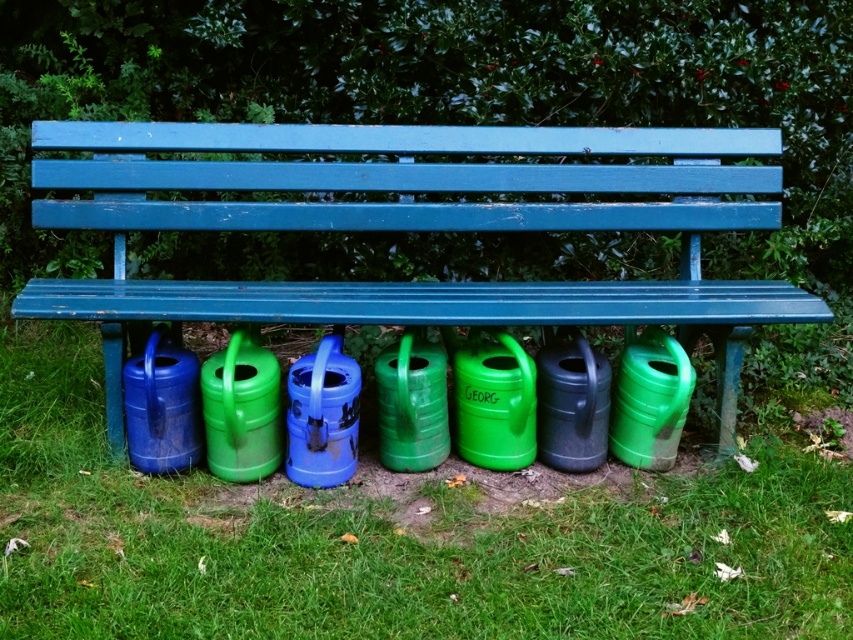
Does green matte watering cans at lower center have a smaller size compared to matte blue bench at center?

No.

Which is behind, point (850, 564) or point (372, 221)?

Positioned behind is point (372, 221).

The width and height of the screenshot is (853, 640). In order to click on green matte watering cans at lower center in this screenshot , I will do `click(392, 541)`.